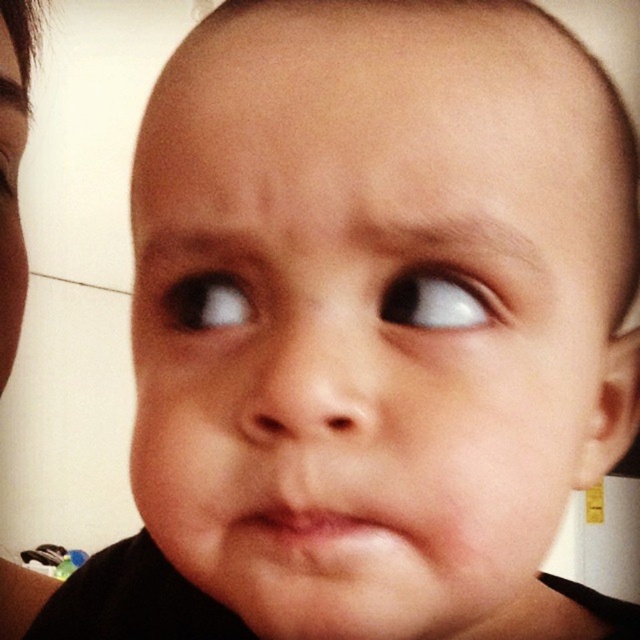
Question: Where is brown hair at upper left located in relation to white glossy eye at upper right in the image?

Choices:
 (A) below
 (B) above

Answer: (B)

Question: Considering the relative positions of white glossy eye at upper right and pink matte lips at center in the image provided, where is white glossy eye at upper right located with respect to pink matte lips at center?

Choices:
 (A) above
 (B) below

Answer: (A)

Question: Which point is closer to the camera?

Choices:
 (A) (17, 147)
 (B) (461, 314)

Answer: (B)

Question: Is brown hair at left wider than pink matte lips at center?

Choices:
 (A) yes
 (B) no

Answer: (A)

Question: Which point is closer to the camera?

Choices:
 (A) (33, 1)
 (B) (220, 323)
 (C) (22, 301)

Answer: (B)

Question: Among these objects, which one is nearest to the camera?

Choices:
 (A) brown glossy eye at upper center
 (B) brown hair at left

Answer: (A)